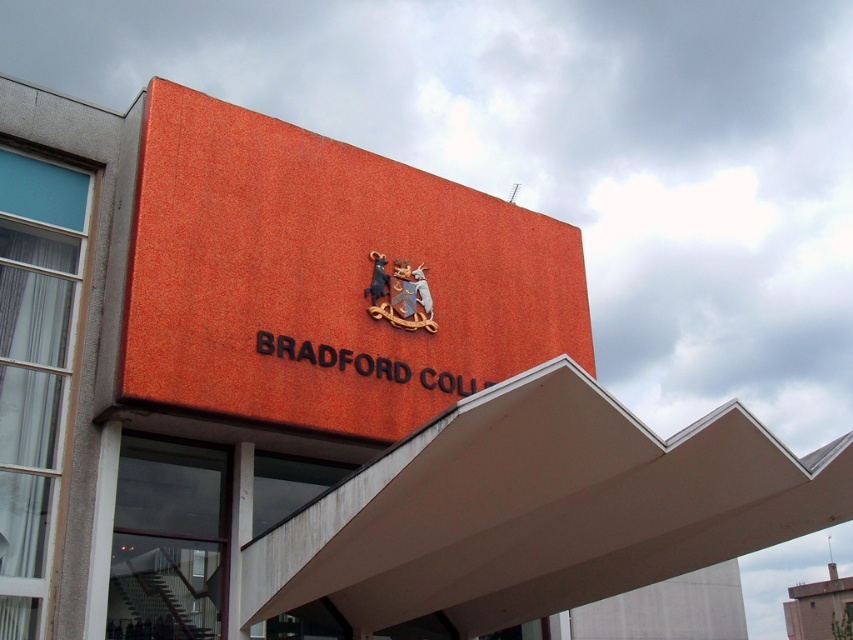
Question: Is orange textured sign at center closer to the viewer compared to wooden coat of arms at center?

Choices:
 (A) yes
 (B) no

Answer: (A)

Question: Is orange textured sign at center bigger than wooden coat of arms at center?

Choices:
 (A) no
 (B) yes

Answer: (B)

Question: Is orange textured sign at center below wooden coat of arms at center?

Choices:
 (A) yes
 (B) no

Answer: (B)

Question: Which point is farther to the camera?

Choices:
 (A) orange textured sign at center
 (B) wooden coat of arms at center

Answer: (B)